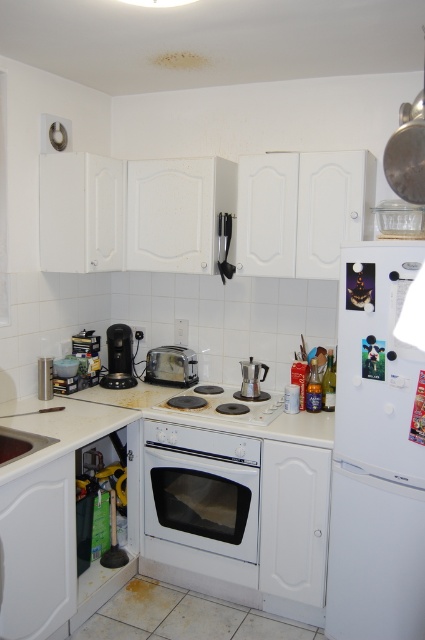
Is point (263, 401) positioned before point (108, 380)?

Yes, point (263, 401) is closer to viewer.

I want to click on white glossy stove at center, so (x=221, y=403).

The height and width of the screenshot is (640, 425). I want to click on white glossy stove at center, so click(221, 403).

Is point (161, 474) farther from camera compared to point (212, 396)?

No, it is not.

This screenshot has width=425, height=640. What are the coordinates of `white glossy oven at center` in the screenshot? It's located at (201, 488).

At what (x,y) coordinates should I click in order to perform the action: click on white glossy oven at center. Please return your answer as a coordinate pair (x, y). The height and width of the screenshot is (640, 425). Looking at the image, I should click on (201, 488).

Identify the location of white glossy oven at center. The width and height of the screenshot is (425, 640). (201, 488).

Is white glossy countertop at lower left wider than satin silver coffee maker at center?

Indeed, white glossy countertop at lower left has a greater width compared to satin silver coffee maker at center.

Which of these two, white glossy countertop at lower left or satin silver coffee maker at center, stands taller?

satin silver coffee maker at center

Who is more forward, (22, 461) or (246, 372)?

Point (22, 461) is in front.

In order to click on white glossy countertop at lower left in this screenshot , I will do `click(59, 429)`.